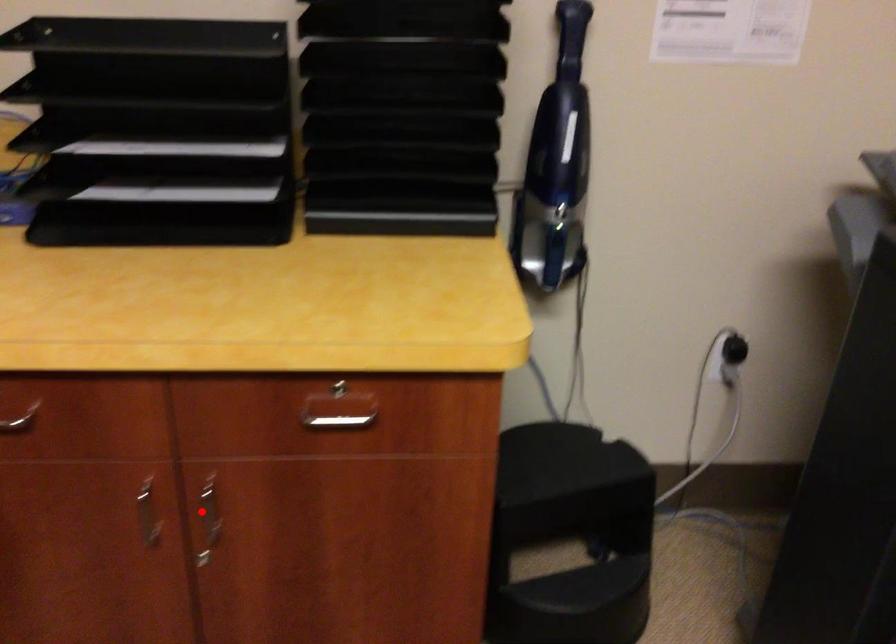
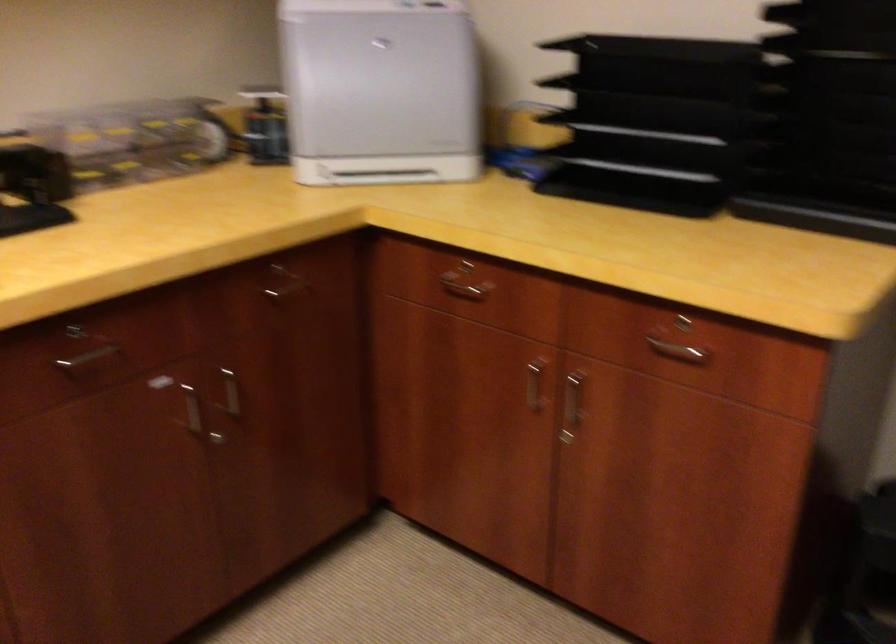
Question: I am providing you with two images of the same scene from different viewpoints. A red point is shown in image1. For the corresponding object point in image2, is it positioned nearer or farther from the camera?

Choices:
 (A) Nearer
 (B) Farther

Answer: (B)